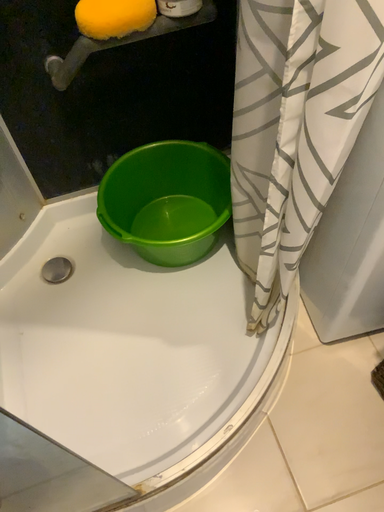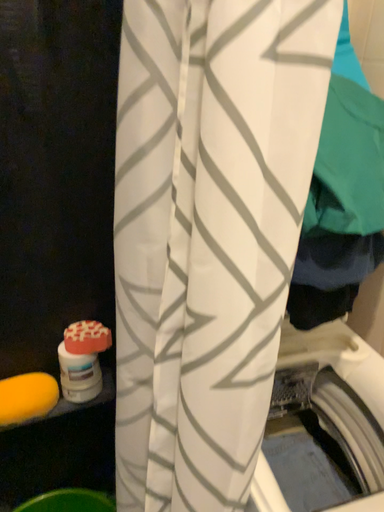
Question: Which way did the camera rotate in the video?

Choices:
 (A) rotated left
 (B) rotated right

Answer: (B)